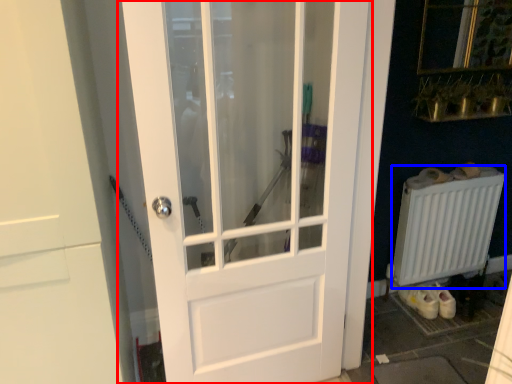
Question: Which point is closer to the camera, door (highlighted by a red box) or radiator (highlighted by a blue box)?

Choices:
 (A) door
 (B) radiator

Answer: (A)